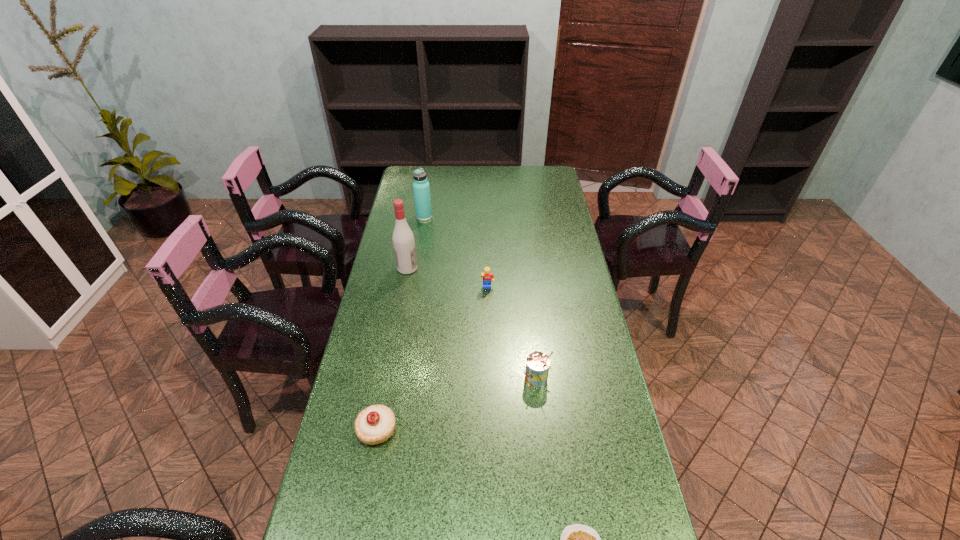
Where is `vacant space that satisfies the following two spatial constraints: 1. on the face of the Lego; 2. on the left side of the third nearest object`? Image resolution: width=960 pixels, height=540 pixels. vacant space that satisfies the following two spatial constraints: 1. on the face of the Lego; 2. on the left side of the third nearest object is located at coordinates (490, 379).